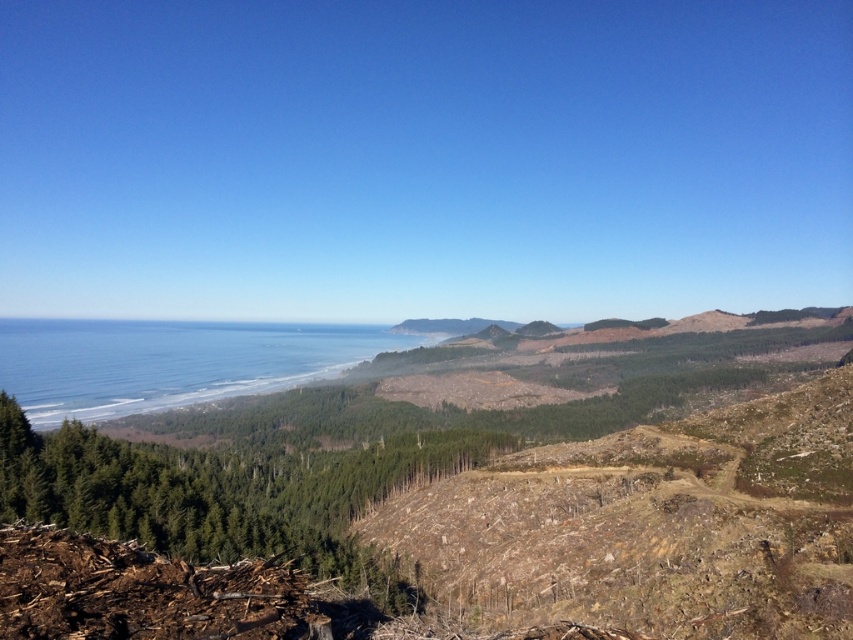
Can you confirm if green textured trees at center is smaller than blue water at center?

Yes.

Can you confirm if green textured trees at center is shorter than blue water at center?

Yes, green textured trees at center is shorter than blue water at center.

Which is behind, point (65, 472) or point (61, 369)?

The point (61, 369) is behind.

Find the location of `green textured trees at center`. green textured trees at center is located at coordinates (222, 493).